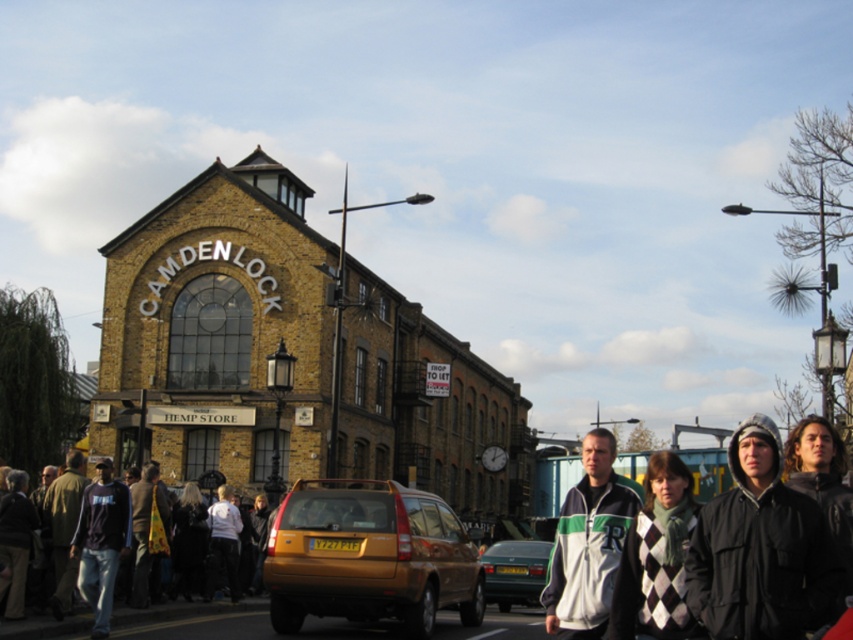
Which is below, black cotton hoodie at lower left or dark gray fabric crowd at lower left?

dark gray fabric crowd at lower left is lower down.

What do you see at coordinates (102, 541) in the screenshot? Image resolution: width=853 pixels, height=640 pixels. I see `black cotton hoodie at lower left` at bounding box center [102, 541].

Who is more forward, (82, 572) or (125, 614)?

Positioned in front is point (82, 572).

What are the coordinates of `black cotton hoodie at lower left` in the screenshot? It's located at (102, 541).

Which is more to the right, black cotton hoodie at lower left or metallic silver car at center?

metallic silver car at center

Does black cotton hoodie at lower left have a lesser height compared to metallic silver car at center?

No, black cotton hoodie at lower left is not shorter than metallic silver car at center.

Does point (85, 560) come farther from viewer compared to point (540, 588)?

No, (85, 560) is closer to viewer.

Image resolution: width=853 pixels, height=640 pixels. Identify the location of black cotton hoodie at lower left. (102, 541).

Is point (386, 516) closer to viewer compared to point (93, 605)?

No, it is behind (93, 605).

Can you confirm if gold matte taxi at center is positioned above black cotton hoodie at lower left?

Incorrect, gold matte taxi at center is not positioned above black cotton hoodie at lower left.

Is point (393, 588) less distant than point (100, 598)?

That is False.

At what (x,y) coordinates should I click in order to perform the action: click on gold matte taxi at center. Please return your answer as a coordinate pair (x, y). The height and width of the screenshot is (640, 853). Looking at the image, I should click on (369, 556).